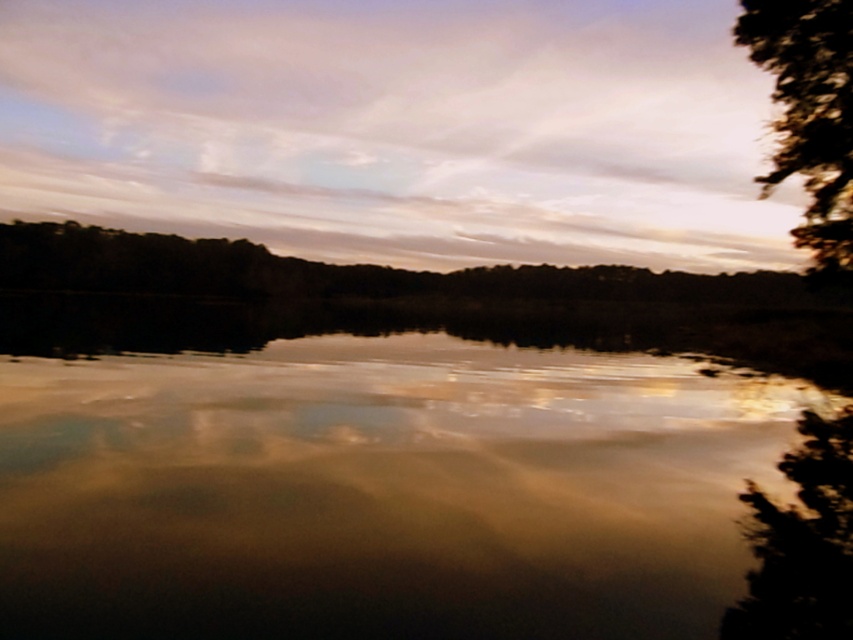
Question: Considering the real-world distances, which object is farthest from the dark green textured tree at right?

Choices:
 (A) green leafy tree at right
 (B) brown reflective water at center
 (C) brown matte tree at center

Answer: (C)

Question: Which point is closer to the camera?

Choices:
 (A) (490, 333)
 (B) (837, 96)
 (C) (767, 227)

Answer: (B)

Question: Can you confirm if dark green textured tree at right is wider than green leafy tree at right?

Choices:
 (A) yes
 (B) no

Answer: (A)

Question: Is brown reflective water at center to the right of dark green textured tree at right from the viewer's perspective?

Choices:
 (A) no
 (B) yes

Answer: (A)

Question: Can you confirm if brown reflective water at center is positioned to the right of brown matte tree at center?

Choices:
 (A) yes
 (B) no

Answer: (B)

Question: Considering the real-world distances, which object is closest to the brown matte tree at center?

Choices:
 (A) cloudy sky at upper center
 (B) dark green textured tree at right
 (C) brown reflective water at center
 (D) green leafy tree at right

Answer: (C)